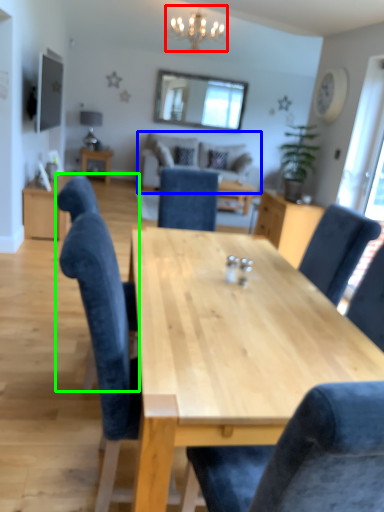
Question: Estimate the real-world distances between objects in this image. Which object is farther from light fixture (highlighted by a red box), couch (highlighted by a blue box) or chair (highlighted by a green box)?

Choices:
 (A) couch
 (B) chair

Answer: (B)